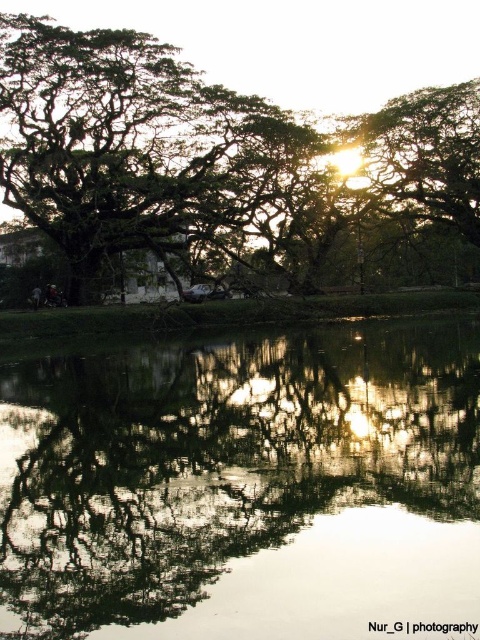
Question: Which of the following is the closest to the observer?

Choices:
 (A) (35, 48)
 (B) (40, 550)

Answer: (B)

Question: Is transparent water at center above green leafy tree at upper left?

Choices:
 (A) yes
 (B) no

Answer: (B)

Question: Which point appears closest to the camera in this image?

Choices:
 (A) 194,342
 (B) 90,218

Answer: (A)

Question: Does transparent water at center appear on the left side of green leafy tree at upper left?

Choices:
 (A) yes
 (B) no

Answer: (A)

Question: Can you confirm if transparent water at center is bigger than green leafy tree at upper left?

Choices:
 (A) no
 (B) yes

Answer: (A)